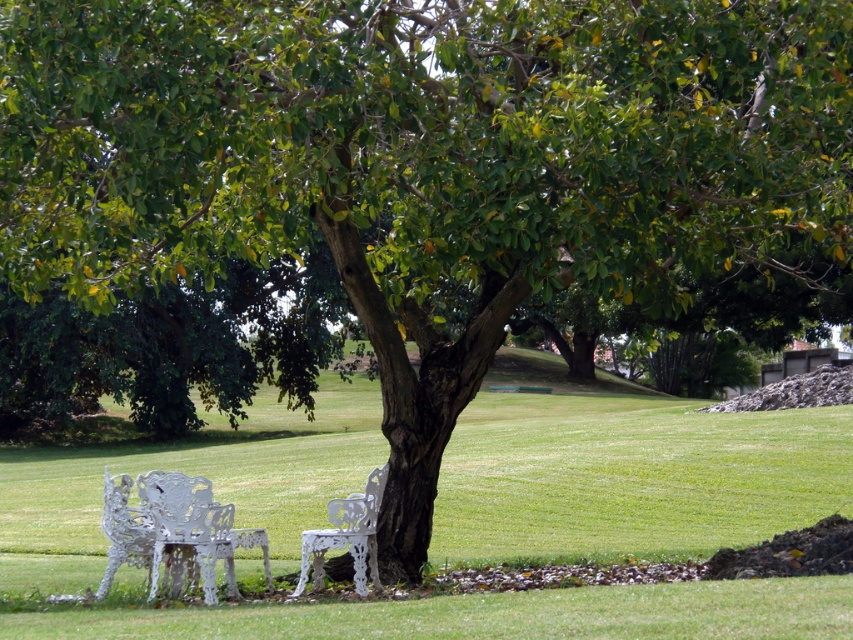
Question: Considering the real-world distances, which object is farthest from the white metal bench at lower left?

Choices:
 (A) white wrought iron bench at center
 (B) green grass at center

Answer: (B)

Question: Is green grass at center positioned before white metal bench at lower left?

Choices:
 (A) no
 (B) yes

Answer: (B)

Question: Does white metal bench at lower left appear on the right side of white wrought iron bench at center?

Choices:
 (A) no
 (B) yes

Answer: (A)

Question: Which object appears closest to the camera in this image?

Choices:
 (A) white metal bench at lower left
 (B) green grass at center
 (C) white wrought iron bench at center

Answer: (B)

Question: Is green grass at center positioned at the back of white metal bench at lower left?

Choices:
 (A) no
 (B) yes

Answer: (A)

Question: Which point is farther to the camera?

Choices:
 (A) green grass at center
 (B) white wrought iron bench at center
 (C) white metal bench at lower left

Answer: (B)